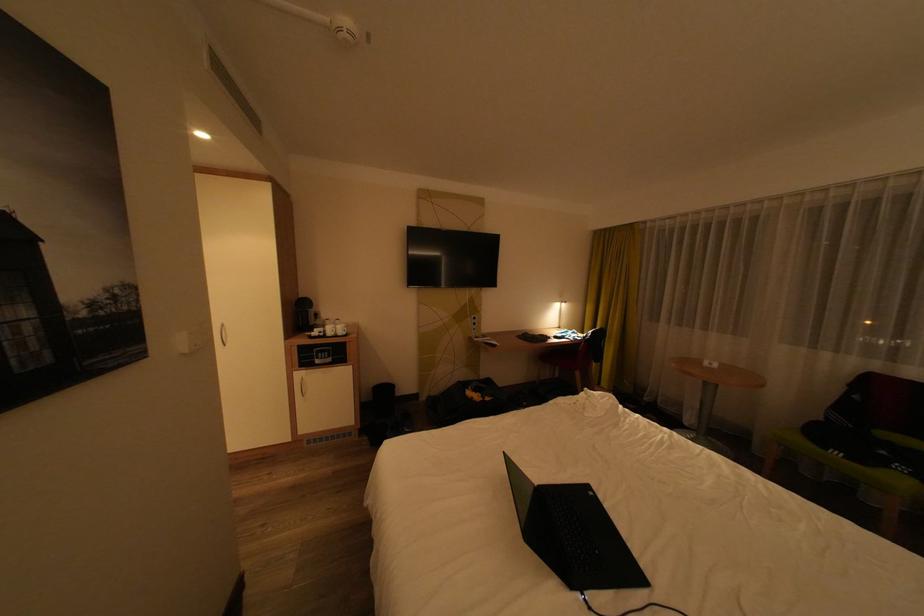
Find the location of a particular element. This screenshot has height=616, width=924. brown chair sitting surface is located at coordinates (852, 440).